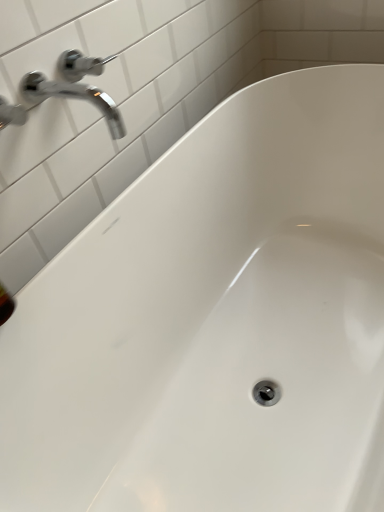
Measure the distance between chrome metallic faucet at upper left and camera.

chrome metallic faucet at upper left is 30.20 inches away from camera.

Identify the location of chrome metallic faucet at upper left. This screenshot has width=384, height=512. (76, 87).

The image size is (384, 512). What do you see at coordinates (76, 87) in the screenshot?
I see `chrome metallic faucet at upper left` at bounding box center [76, 87].

Locate an element on the screen. The image size is (384, 512). chrome metallic faucet at upper left is located at coordinates (76, 87).